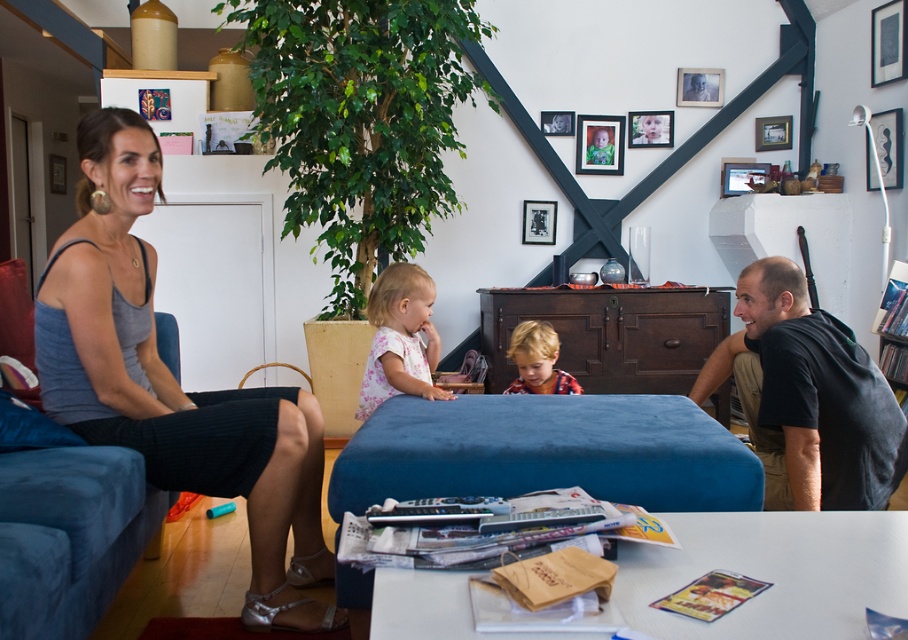
Question: Is black cotton shirt at right closer to camera compared to plaid cotton shirt at center?

Choices:
 (A) yes
 (B) no

Answer: (A)

Question: Is matte gray tank top at left positioned before plaid cotton shirt at center?

Choices:
 (A) yes
 (B) no

Answer: (A)

Question: Which of these objects is positioned closest to the matte gray tank top at left?

Choices:
 (A) blue fabric couch at left
 (B) black cotton shirt at right
 (C) plaid cotton shirt at center

Answer: (A)

Question: Which of the following is the closest to the observer?

Choices:
 (A) blue fabric couch at left
 (B) black cotton shirt at right
 (C) plaid cotton shirt at center
 (D) floral cotton shirt at center

Answer: (A)

Question: Which of the following is the farthest from the observer?

Choices:
 (A) floral cotton shirt at center
 (B) plaid cotton shirt at center
 (C) matte gray tank top at left

Answer: (B)

Question: Can you confirm if matte gray tank top at left is positioned below floral cotton shirt at center?

Choices:
 (A) yes
 (B) no

Answer: (A)